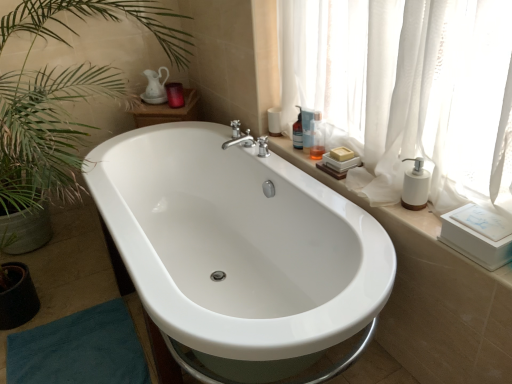
Question: From a real-world perspective, does translucent plastic bottle at upper right, acting as the third toiletry starting from the left, stand above matte purple candle at upper center, the first toiletry from the back?

Choices:
 (A) no
 (B) yes

Answer: (B)

Question: Is matte purple candle at upper center, the 4th toiletry in the front-to-back sequence, at the back of translucent plastic bottle at upper right, positioned as the second toiletry in right-to-left order?

Choices:
 (A) no
 (B) yes

Answer: (A)

Question: Is matte purple candle at upper center, the first toiletry from the back, surrounded by translucent plastic bottle at upper right, the 2th toiletry when ordered from front to back?

Choices:
 (A) no
 (B) yes

Answer: (A)

Question: Considering the relative sizes of translucent plastic bottle at upper right, the third toiletry from the back, and matte purple candle at upper center, the 1th toiletry from the left, in the image provided, is translucent plastic bottle at upper right, the third toiletry from the back, smaller than matte purple candle at upper center, the 1th toiletry from the left,?

Choices:
 (A) no
 (B) yes

Answer: (B)

Question: Is translucent plastic bottle at upper right, the 2th toiletry when ordered from front to back, placed right next to matte purple candle at upper center, the 1th toiletry from the left?

Choices:
 (A) yes
 (B) no

Answer: (B)

Question: Considering the positions of white ceramic window sill at upper right and white sheer curtain at upper right in the image, is white ceramic window sill at upper right bigger or smaller than white sheer curtain at upper right?

Choices:
 (A) small
 (B) big

Answer: (A)

Question: Is white ceramic window sill at upper right taller or shorter than white sheer curtain at upper right?

Choices:
 (A) short
 (B) tall

Answer: (A)

Question: In terms of width, does white ceramic window sill at upper right look wider or thinner when compared to white sheer curtain at upper right?

Choices:
 (A) wide
 (B) thin

Answer: (B)

Question: Is point (415, 266) closer or farther from the camera than point (502, 114)?

Choices:
 (A) closer
 (B) farther

Answer: (B)

Question: Looking at their shapes, would you say matte purple candle at upper center, the 4th toiletry in the front-to-back sequence, is wider or thinner than white sheer curtain at upper right?

Choices:
 (A) wide
 (B) thin

Answer: (B)

Question: In terms of size, does matte purple candle at upper center, the 4th toiletry in the front-to-back sequence, appear bigger or smaller than white sheer curtain at upper right?

Choices:
 (A) small
 (B) big

Answer: (A)

Question: Considering their positions, is matte purple candle at upper center, the first toiletry from the back, located in front of or behind white sheer curtain at upper right?

Choices:
 (A) behind
 (B) front

Answer: (A)

Question: From a real-world perspective, is matte purple candle at upper center, the 4th toiletry viewed from the right, above or below white sheer curtain at upper right?

Choices:
 (A) below
 (B) above

Answer: (A)

Question: Based on their sizes in the image, would you say translucent glass bottle at upper right, the 2th toiletry positioned from the back, is bigger or smaller than translucent plastic bottle at upper right, which appears as the first toiletry when viewed from the front?

Choices:
 (A) small
 (B) big

Answer: (A)

Question: Is point (296, 144) positioned closer to the camera than point (313, 145)?

Choices:
 (A) farther
 (B) closer

Answer: (A)